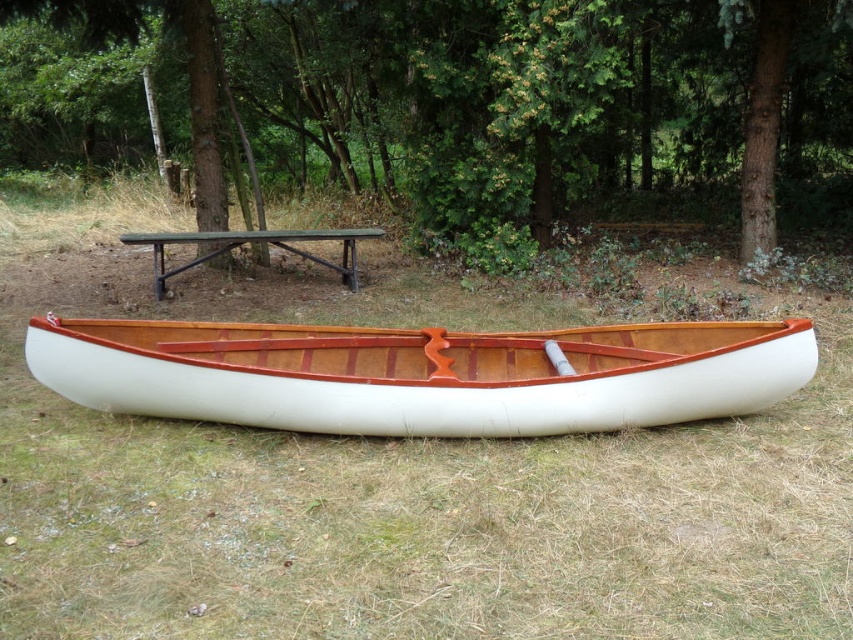
You are standing at the camera position and want to take a photo of the green leafy tree at center. If your camera can focus on objects up to 5 meters away, will you need to adjust the focus to capture the tree clearly?

The green leafy tree at center is 6.13 meters from the camera, which is beyond the camera focus range of 5 meters. Therefore, you will need to adjust the focus to capture the tree clearly.

You are standing at the picnic table made of dark metal with a flat top and want to walk towards the green leafy tree at center. Which direction should you walk to reach it?

The green leafy tree at center is located at point (479, 92), so you should walk towards that coordinate to reach it.